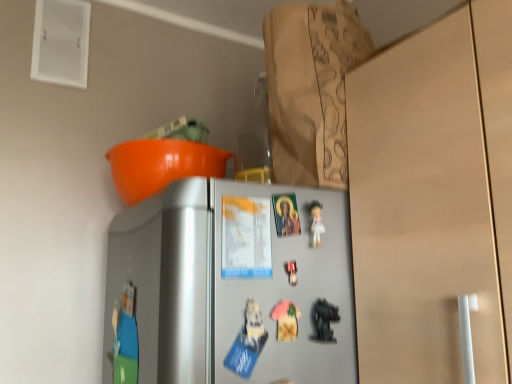
This screenshot has height=384, width=512. What do you see at coordinates (311, 89) in the screenshot?
I see `brown paper bag at upper center` at bounding box center [311, 89].

This screenshot has height=384, width=512. Describe the element at coordinates (291, 272) in the screenshot. I see `metallic silver toy at center, which is counted as the 2th toy, starting from the right` at that location.

The width and height of the screenshot is (512, 384). Identify the location of metallic silver fridge at center. (227, 285).

Who is shorter, pink fabric magnet at center, the first toy in the left-to-right sequence, or metallic silver fridge at center?

pink fabric magnet at center, the first toy in the left-to-right sequence.

Looking at this image, between pink fabric magnet at center, acting as the third toy starting from the right, and metallic silver fridge at center, which one has larger size?

With larger size is metallic silver fridge at center.

Does pink fabric magnet at center, acting as the third toy starting from the right, turn towards metallic silver fridge at center?

No, pink fabric magnet at center, acting as the third toy starting from the right, is not aimed at metallic silver fridge at center.

Does metallic silver fridge at center come in front of brown paper bag at upper center?

Yes, metallic silver fridge at center is in front of brown paper bag at upper center.

Considering the sizes of objects metallic silver fridge at center and brown paper bag at upper center in the image provided, who is wider, metallic silver fridge at center or brown paper bag at upper center?

Answer: brown paper bag at upper center.

In the scene shown: Considering the relative sizes of metallic silver fridge at center and brown paper bag at upper center in the image provided, is metallic silver fridge at center shorter than brown paper bag at upper center?

Indeed, metallic silver fridge at center has a lesser height compared to brown paper bag at upper center.

Locate an element on the screen. This screenshot has height=384, width=512. refrigerator in front of the brown paper bag at upper center is located at coordinates (227, 285).

Consider the image. Which of these two, metallic silver toy at center, which is counted as the 2th toy, starting from the right, or metallic black toy at lower right, the first toy from the right, stands taller?

With more height is metallic black toy at lower right, the first toy from the right.

Is metallic silver toy at center, which is counted as the 2th toy, starting from the right, turned away from metallic black toy at lower right, the first toy from the right?

That's not correct — metallic silver toy at center, which is counted as the 2th toy, starting from the right, is not looking away from metallic black toy at lower right, the first toy from the right.

Does point (293, 277) come farther from viewer compared to point (331, 313)?

No, it is in front of (331, 313).

There is a metallic silver toy at center, which is counted as the 2th toy, starting from the right. Where is `the 2nd toy below it (from the image's perspective)`? the 2nd toy below it (from the image's perspective) is located at coordinates [x=324, y=320].

Considering the sizes of metallic silver toy at center, the second toy from the left, and pink fabric magnet at center, acting as the third toy starting from the right, in the image, is metallic silver toy at center, the second toy from the left, taller or shorter than pink fabric magnet at center, acting as the third toy starting from the right,?

Clearly, metallic silver toy at center, the second toy from the left, is shorter compared to pink fabric magnet at center, acting as the third toy starting from the right.

What's the angular difference between metallic silver toy at center, the second toy from the left, and pink fabric magnet at center, the first toy in the left-to-right sequence,'s facing directions?

0.0137 degrees separate the facing orientations of metallic silver toy at center, the second toy from the left, and pink fabric magnet at center, the first toy in the left-to-right sequence.

Does point (290, 270) come behind point (282, 320)?

Yes, point (290, 270) is behind point (282, 320).

Looking at their sizes, would you say metallic black toy at lower right, the first toy from the right, is wider or thinner than brown paper bag at upper center?

Considering their sizes, metallic black toy at lower right, the first toy from the right, looks slimmer than brown paper bag at upper center.

From a real-world perspective, is metallic black toy at lower right, the first toy from the right, below brown paper bag at upper center?

Yes, from a real-world perspective, metallic black toy at lower right, the first toy from the right, is under brown paper bag at upper center.

Are metallic black toy at lower right, arranged as the 3th toy when viewed from the left, and brown paper bag at upper center located far from each other?

No.

In terms of height, does metallic black toy at lower right, arranged as the 3th toy when viewed from the left, look taller or shorter compared to brown paper bag at upper center?

metallic black toy at lower right, arranged as the 3th toy when viewed from the left, is shorter than brown paper bag at upper center.

How many degrees apart are the facing directions of brown paper bag at upper center and metallic silver toy at center, which is counted as the 2th toy, starting from the right?

They differ by 90 degrees in their facing directions.

Is brown paper bag at upper center in contact with metallic silver toy at center, which is counted as the 2th toy, starting from the right?

There is a gap between brown paper bag at upper center and metallic silver toy at center, which is counted as the 2th toy, starting from the right.

Is point (292, 43) closer or farther from the camera than point (294, 274)?

Point (292, 43) is farther from the camera than point (294, 274).

From the image's perspective, is brown paper bag at upper center beneath metallic silver toy at center, the second toy from the left?

Actually, brown paper bag at upper center appears above metallic silver toy at center, the second toy from the left, in the image.

Which of these two, metallic silver toy at center, the second toy from the left, or brown paper bag at upper center, is smaller?

With smaller size is metallic silver toy at center, the second toy from the left.

How different are the orientations of metallic silver toy at center, which is counted as the 2th toy, starting from the right, and brown paper bag at upper center in degrees?

The facing directions of metallic silver toy at center, which is counted as the 2th toy, starting from the right, and brown paper bag at upper center are 90 degrees apart.

Considering the relative positions of metallic silver toy at center, which is counted as the 2th toy, starting from the right, and brown paper bag at upper center in the image provided, is metallic silver toy at center, which is counted as the 2th toy, starting from the right, to the left of brown paper bag at upper center from the viewer's perspective?

Indeed, metallic silver toy at center, which is counted as the 2th toy, starting from the right, is positioned on the left side of brown paper bag at upper center.

Which object is thinner, metallic silver toy at center, the second toy from the left, or brown paper bag at upper center?

Thinner between the two is metallic silver toy at center, the second toy from the left.

There is a pink fabric magnet at center, acting as the third toy starting from the right. Where is `refrigerator above it (from a real-world perspective)`? The width and height of the screenshot is (512, 384). refrigerator above it (from a real-world perspective) is located at coordinates pos(227,285).

You are a GUI agent. You are given a task and a screenshot of the screen. Output one action in this format:
    pyautogui.click(x=<x>, y=<y>)
    Task: Click on the refrigerator that is below the brown paper bag at upper center (from the image's perspective)
    
    Given the screenshot: What is the action you would take?
    pyautogui.click(x=227, y=285)

Estimate the real-world distances between objects in this image. Which object is closer to metallic silver toy at center, which is counted as the 2th toy, starting from the right, metallic silver fridge at center or pink fabric magnet at center, the first toy in the left-to-right sequence?

pink fabric magnet at center, the first toy in the left-to-right sequence, is positioned closer to the anchor metallic silver toy at center, which is counted as the 2th toy, starting from the right.

In the scene shown: Considering their positions, is metallic silver toy at center, the second toy from the left, positioned closer to metallic silver fridge at center than metallic black toy at lower right, the first toy from the right?

Based on the image, metallic silver toy at center, the second toy from the left, appears to be nearer to metallic silver fridge at center.

Considering their positions, is pink fabric magnet at center, acting as the third toy starting from the right, positioned closer to brown paper bag at upper center than metallic silver fridge at center?

metallic silver fridge at center lies closer to brown paper bag at upper center than the other object.

Based on their spatial positions, is pink fabric magnet at center, the first toy in the left-to-right sequence, or metallic silver fridge at center closer to metallic black toy at lower right, the first toy from the right?

pink fabric magnet at center, the first toy in the left-to-right sequence, lies closer to metallic black toy at lower right, the first toy from the right, than the other object.

Considering their positions, is metallic silver toy at center, the second toy from the left, positioned further to pink fabric magnet at center, acting as the third toy starting from the right, than metallic black toy at lower right, arranged as the 3th toy when viewed from the left?

metallic black toy at lower right, arranged as the 3th toy when viewed from the left.

Based on their spatial positions, is metallic black toy at lower right, the first toy from the right, or metallic silver fridge at center closer to pink fabric magnet at center, acting as the third toy starting from the right?

metallic black toy at lower right, the first toy from the right, is positioned closer to the anchor pink fabric magnet at center, acting as the third toy starting from the right.

Looking at the image, which one is located further to metallic silver toy at center, which is counted as the 2th toy, starting from the right, brown paper bag at upper center or metallic silver fridge at center?

brown paper bag at upper center is positioned further to the anchor metallic silver toy at center, which is counted as the 2th toy, starting from the right.

From the image, which object appears to be farther from metallic silver fridge at center, brown paper bag at upper center or pink fabric magnet at center, acting as the third toy starting from the right?

Among the two, brown paper bag at upper center is located further to metallic silver fridge at center.

The width and height of the screenshot is (512, 384). Identify the location of refrigerator that lies between brown paper bag at upper center and metallic black toy at lower right, arranged as the 3th toy when viewed from the left, from top to bottom. (227, 285).

Where is `toy that lies between metallic silver toy at center, which is counted as the 2th toy, starting from the right, and metallic black toy at lower right, the first toy from the right, from top to bottom`? The height and width of the screenshot is (384, 512). toy that lies between metallic silver toy at center, which is counted as the 2th toy, starting from the right, and metallic black toy at lower right, the first toy from the right, from top to bottom is located at coordinates pyautogui.click(x=286, y=320).

Find the location of a particular element. This screenshot has width=512, height=384. refrigerator between brown paper bag at upper center and pink fabric magnet at center, the first toy in the left-to-right sequence, in the vertical direction is located at coordinates (227, 285).

Where is `toy between brown paper bag at upper center and metallic silver fridge at center in the up-down direction`? This screenshot has height=384, width=512. toy between brown paper bag at upper center and metallic silver fridge at center in the up-down direction is located at coordinates (291, 272).